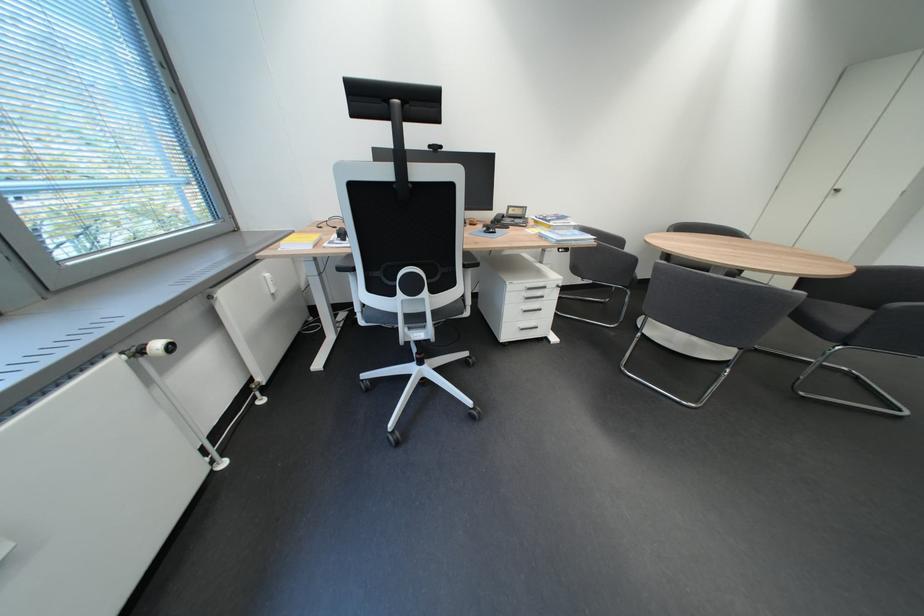
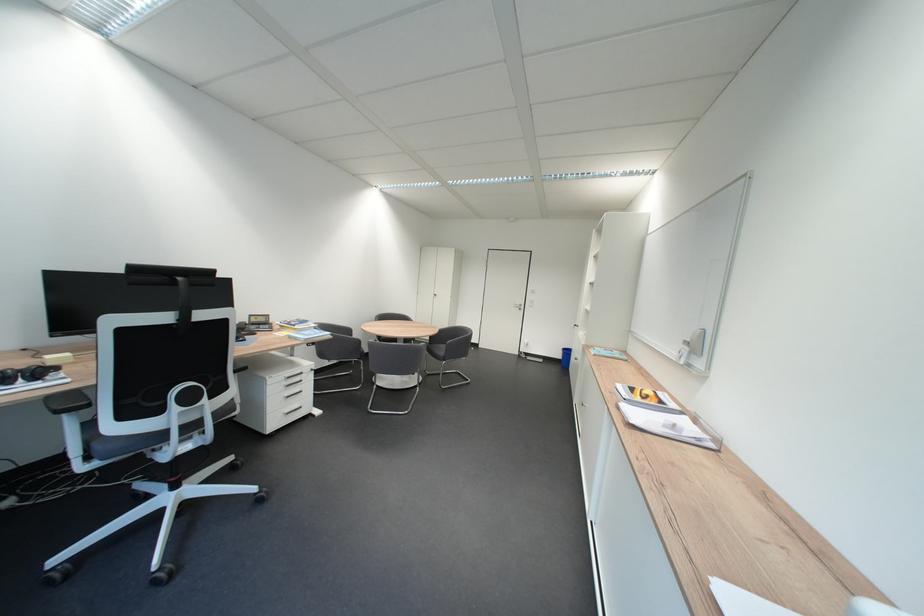
Question: The camera is either moving clockwise (left) or counter-clockwise (right) around the object. The first image is from the beginning of the video and the second image is from the end. Is the camera moving left or right when shooting the video?

Choices:
 (A) Left
 (B) Right

Answer: (A)